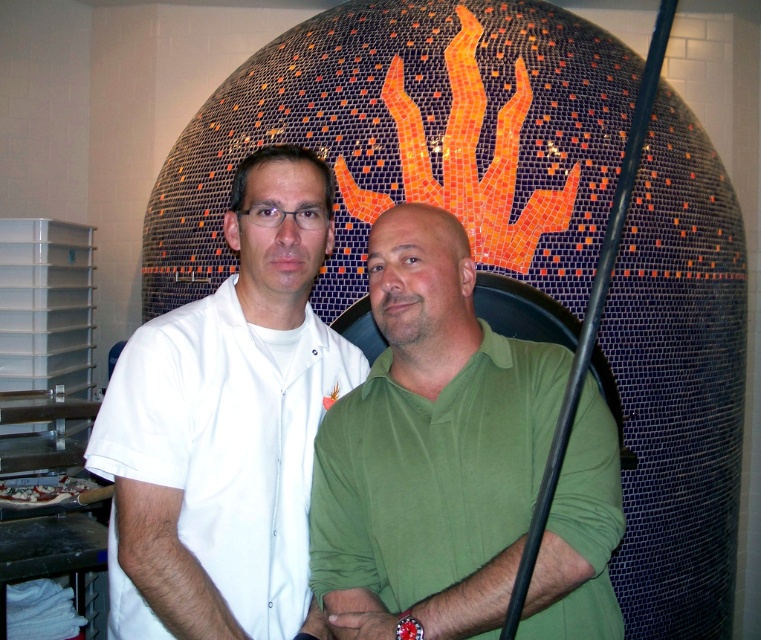
You are a customer at a pizza shop and see the green matte shirt at center and the white glossy pizza at lower left. Which item is closer to you?

The green matte shirt at center is closer to you because it is in front of the white glossy pizza at lower left.

You are a customer at a pizza shop and see the white smooth shirt at center and the white glossy pizza at lower left. Which item is located to the right of the other?

The white smooth shirt at center is positioned on the right side of white glossy pizza at lower left, so the white smooth shirt at center is to the right of the white glossy pizza at lower left.